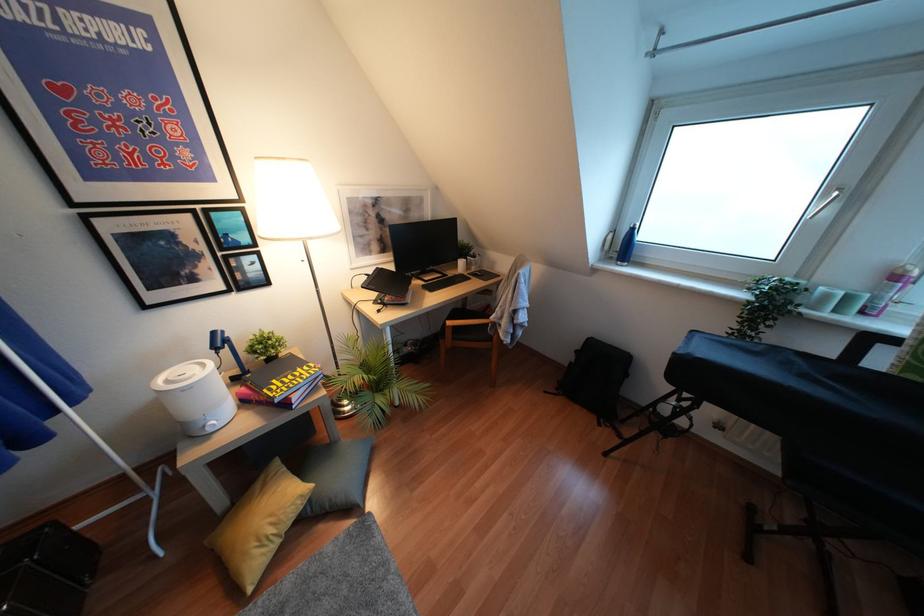
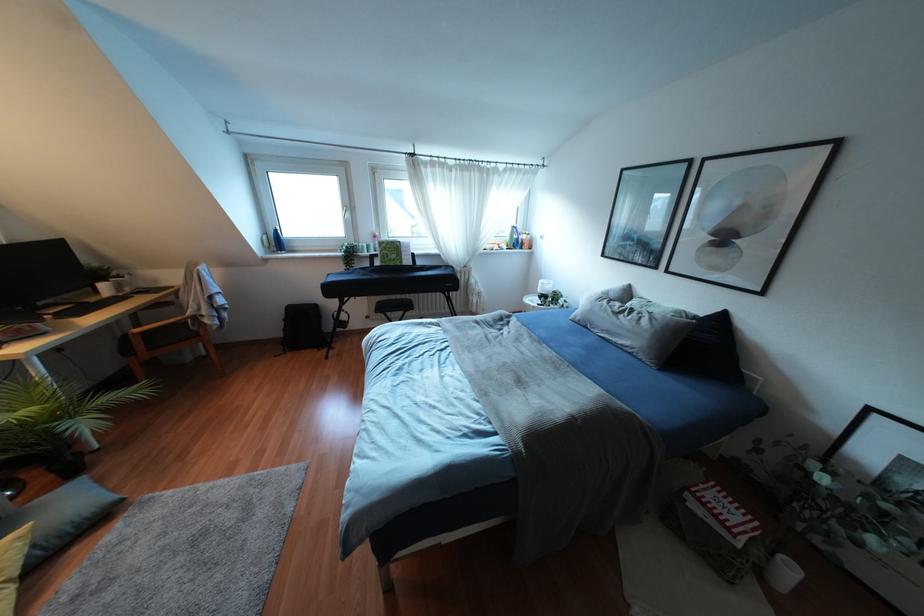
Where in the second image is the point corresponding to point 490,338 from the first image?

(196, 334)